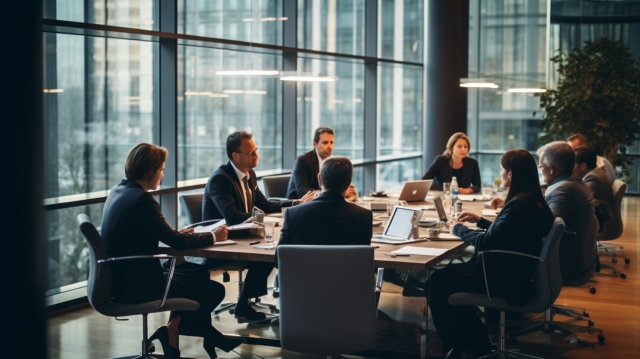
Locate an element on the screen. This screenshot has height=359, width=640. chairs is located at coordinates (109, 294), (195, 207), (273, 188), (339, 285), (538, 277), (595, 256), (616, 208).